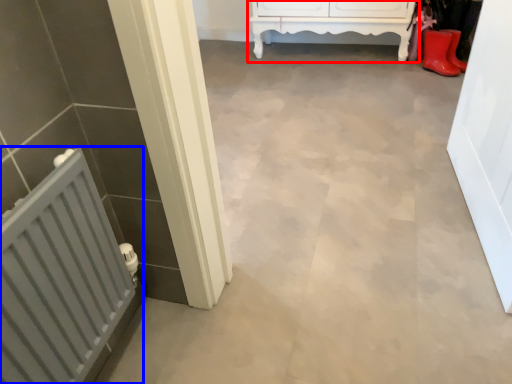
Question: Which point is closer to the camera, furniture (highlighted by a red box) or radiator (highlighted by a blue box)?

Choices:
 (A) furniture
 (B) radiator

Answer: (B)